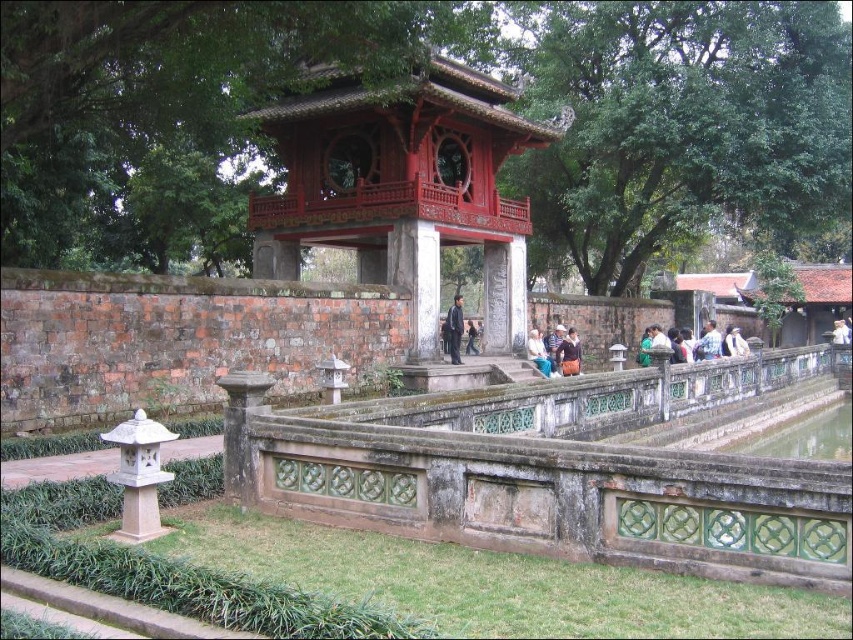
Question: Which of the following is the closest to the observer?

Choices:
 (A) dark blue jeans at center
 (B) dark brown leather jacket at center
 (C) blue fabric bag at center

Answer: (A)

Question: In this image, where is dark blue fabric jacket at lower center located relative to blue fabric bag at center?

Choices:
 (A) left
 (B) right

Answer: (B)

Question: Which is farther from the dark blue fabric jacket at lower center?

Choices:
 (A) shiny red gazebo at center
 (B) white textured fabric at center

Answer: (A)

Question: Does dark blue jeans at center appear on the right side of blue fabric bag at center?

Choices:
 (A) yes
 (B) no

Answer: (B)

Question: Observing the image, what is the correct spatial positioning of dark blue jeans at center in reference to dark brown leather jacket at center?

Choices:
 (A) right
 (B) left

Answer: (B)

Question: Which object appears closest to the camera in this image?

Choices:
 (A) blue fabric bag at center
 (B) light blue shirt at lower right
 (C) white textured fabric at center
 (D) dark blue jeans at center

Answer: (D)